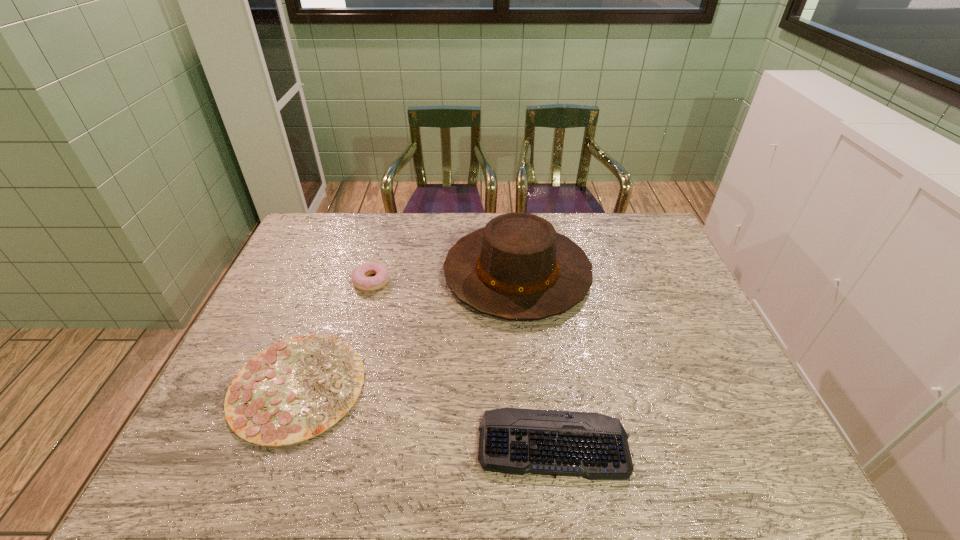
Locate an element on the screen. cowboy hat is located at coordinates (517, 267).

This screenshot has width=960, height=540. Identify the location of the second tallest object. (359, 275).

You are a GUI agent. You are given a task and a screenshot of the screen. Output one action in this format:
    pyautogui.click(x=<x>, y=<y>)
    Task: Click on the second shortest object
    
    Given the screenshot: What is the action you would take?
    pyautogui.click(x=296, y=389)

Locate an element on the screen. the shortest object is located at coordinates (516, 441).

I want to click on vacant space located 0.220m on the front of the cowboy hat, so click(x=529, y=392).

This screenshot has width=960, height=540. I want to click on free region located 0.200m on the back of the doughnut, so pyautogui.click(x=385, y=234).

Find the location of a particular element. vacant space located on the back of the second shortest object is located at coordinates (334, 286).

This screenshot has width=960, height=540. In order to click on vacant space located on the back of the computer keyboard in this screenshot , I will do `click(541, 356)`.

The image size is (960, 540). Identify the location of object at the far edge. (517, 267).

I want to click on pizza that is at the near edge, so click(x=296, y=389).